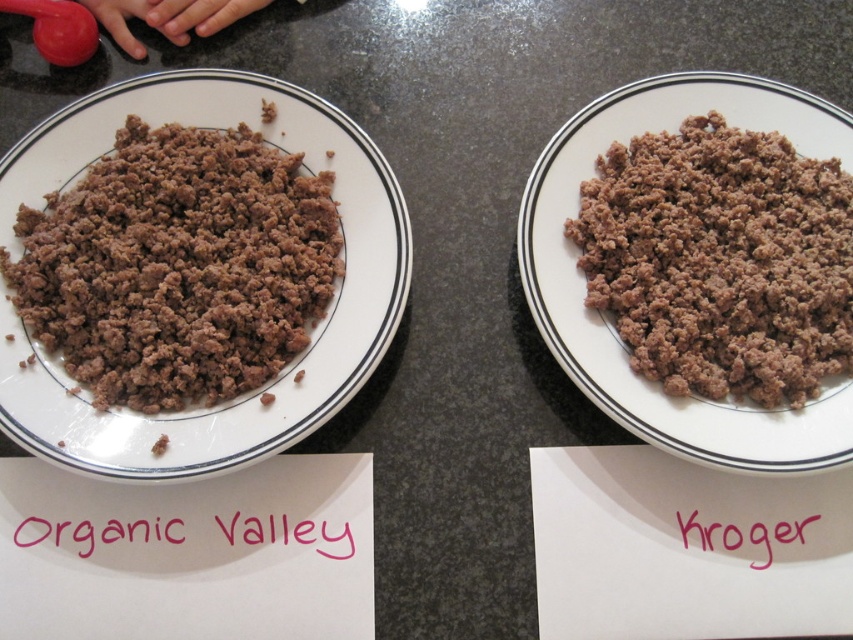
Does point (705, 316) lie behind point (24, 540)?

Yes, point (705, 316) is behind point (24, 540).

Who is taller, brown crumbly ground beef at center or pink paper at upper center?

brown crumbly ground beef at center is taller.

Who is more forward, (637, 147) or (194, 538)?

Point (194, 538) is in front.

In order to click on brown crumbly ground beef at center in this screenshot , I will do `click(720, 260)`.

In the scene shown: Can you confirm if brown crumbly ground beef at left is positioned to the right of brown crumbly ground beef at center?

In fact, brown crumbly ground beef at left is to the left of brown crumbly ground beef at center.

Measure the distance between point (x=221, y=292) and camera.

The distance of point (x=221, y=292) from camera is 34.69 inches.

Find the location of a particular element. This screenshot has height=640, width=853. brown crumbly ground beef at left is located at coordinates coord(178,266).

Can you confirm if pink paper at upper center is positioned to the right of pink paper at center?

In fact, pink paper at upper center is to the left of pink paper at center.

Who is positioned more to the left, pink paper at upper center or pink paper at center?

From the viewer's perspective, pink paper at upper center appears more on the left side.

Is point (51, 536) closer to camera compared to point (784, 524)?

Yes.

At what (x,y) coordinates should I click in order to perform the action: click on pink paper at upper center. Please return your answer as a coordinate pair (x, y). Looking at the image, I should click on (99, 532).